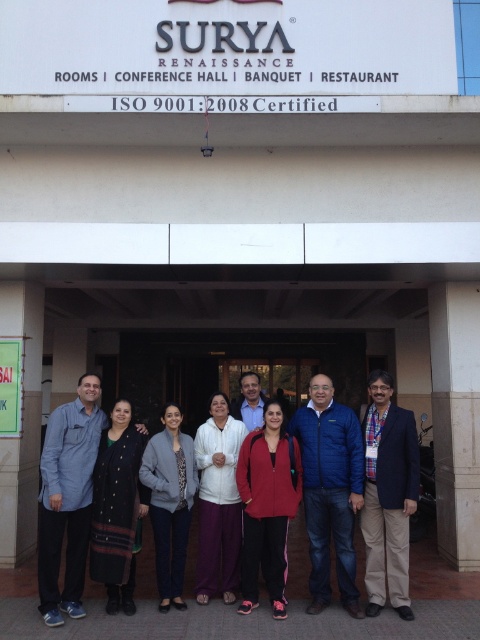
From the picture: Which is above, dark blue denim shirt at center or black woolen shawl at center?

Positioned higher is dark blue denim shirt at center.

Which is more to the left, dark blue denim shirt at center or black woolen shawl at center?

dark blue denim shirt at center is more to the left.

Is point (72, 458) positioned before point (100, 445)?

Yes, point (72, 458) is closer to viewer.

Where is `dark blue denim shirt at center`? dark blue denim shirt at center is located at coordinates (68, 499).

Is matte red jacket at center bigger than white matte sweater at center?

Correct, matte red jacket at center is larger in size than white matte sweater at center.

From the picture: Does matte red jacket at center have a greater height compared to white matte sweater at center?

In fact, matte red jacket at center may be shorter than white matte sweater at center.

Who is more distant from viewer, [248,605] or [223,554]?

The point [223,554] is behind.

The height and width of the screenshot is (640, 480). I want to click on matte red jacket at center, so click(x=266, y=506).

Is point (215, 394) closer to camera compared to point (175, 452)?

No, it is behind (175, 452).

Which is more to the left, white matte sweater at center or matte gray jacket at center?

Positioned to the left is matte gray jacket at center.

Which is in front, point (224, 600) or point (151, 515)?

Point (151, 515)

You are a GUI agent. You are given a task and a screenshot of the screen. Output one action in this format:
    pyautogui.click(x=<x>, y=<y>)
    Task: Click on the white matte sweater at center
    
    Given the screenshot: What is the action you would take?
    pyautogui.click(x=217, y=500)